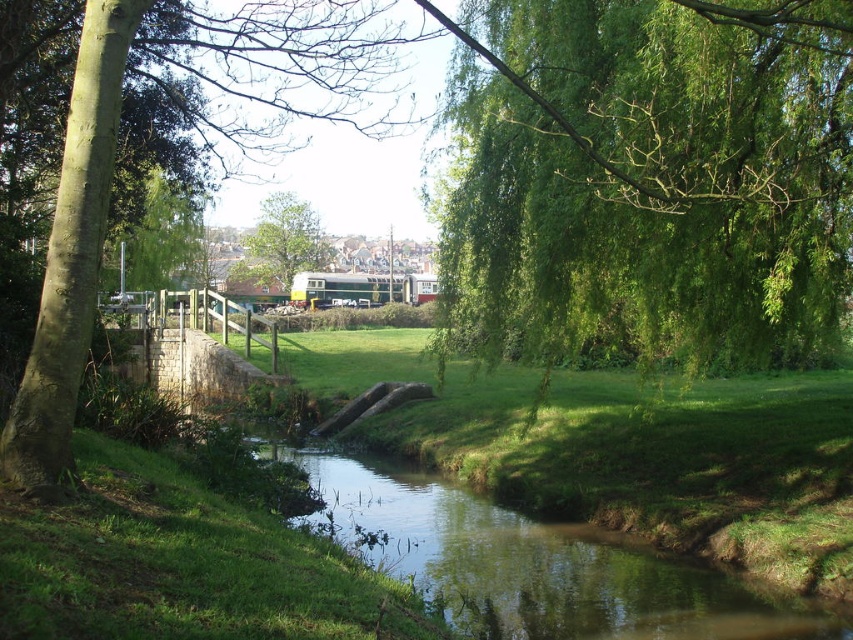
Does green leafy tree at upper left lie behind green leafy tree at upper center?

That is False.

Locate an element on the screen. green leafy tree at upper left is located at coordinates (158, 237).

I want to click on green leafy tree at upper left, so click(158, 237).

Which is above, green grass at center or green leafy tree at upper center?

green leafy tree at upper center is above.

Is point (550, 374) in front of point (300, 243)?

Yes, it is in front of point (300, 243).

The image size is (853, 640). What do you see at coordinates (656, 460) in the screenshot? I see `green grass at center` at bounding box center [656, 460].

What are the coordinates of `green grass at center` in the screenshot? It's located at (656, 460).

Which is below, green grass at center or green leafy tree at upper left?

green grass at center is lower down.

Is point (833, 412) positioned after point (160, 259)?

No, (833, 412) is closer to viewer.

You are a GUI agent. You are given a task and a screenshot of the screen. Output one action in this format:
    pyautogui.click(x=<x>, y=<y>)
    Task: Click on the green grass at center
    Image resolution: width=853 pixels, height=640 pixels.
    Given the screenshot: What is the action you would take?
    pyautogui.click(x=656, y=460)

Find the location of a particular element. green grass at center is located at coordinates (656, 460).